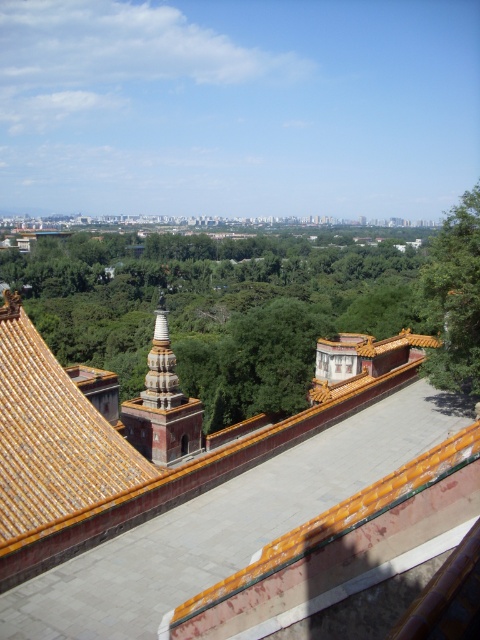
Is golden glazed tiles at center to the left of orange glazed stupa at center from the viewer's perspective?

In fact, golden glazed tiles at center is to the right of orange glazed stupa at center.

Is point (98, 493) less distant than point (176, 440)?

Yes, point (98, 493) is in front of point (176, 440).

Locate an element on the screen. golden glazed tiles at center is located at coordinates (348, 554).

Does orange glazed stupa at center have a greater width compared to white stone stupa at center?

Correct, the width of orange glazed stupa at center exceeds that of white stone stupa at center.

What do you see at coordinates (163, 404) in the screenshot?
I see `orange glazed stupa at center` at bounding box center [163, 404].

Locate an element on the screen. The height and width of the screenshot is (640, 480). orange glazed stupa at center is located at coordinates (163, 404).

In order to click on green leafy tree at center in this screenshot , I will do `click(214, 308)`.

Is point (245, 268) closer to camera compared to point (13, 308)?

No, it is not.

Where is `green leafy tree at center`? green leafy tree at center is located at coordinates (214, 308).